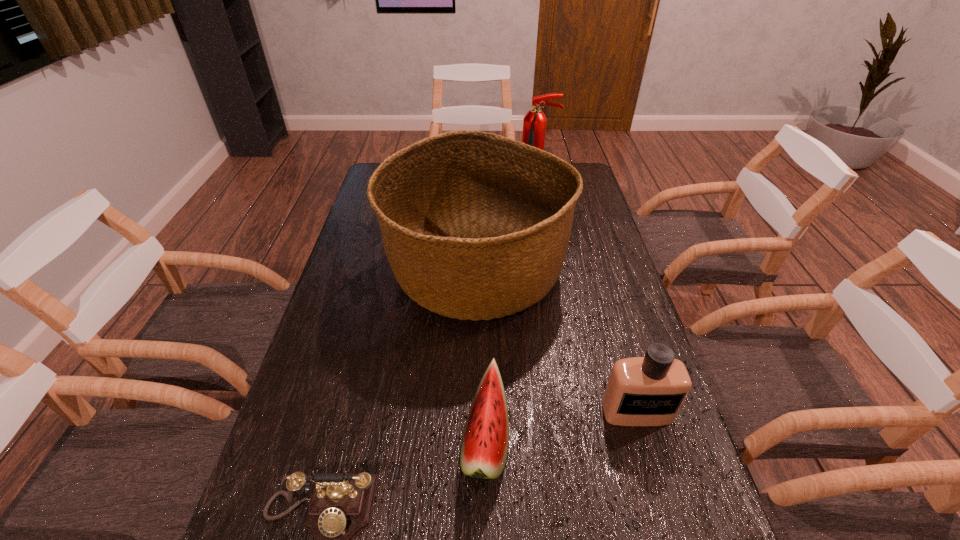
At what (x,y) coordinates should I click in order to perform the action: click on object that stands as the fourth closest to the fourth nearest object. Please return your answer as a coordinate pair (x, y). This screenshot has width=960, height=540. Looking at the image, I should click on (341, 506).

The width and height of the screenshot is (960, 540). What are the coordinates of `free space that satisfies the following two spatial constraints: 1. on the front label of the perfume; 2. on the outer rind of the watermelon` in the screenshot? It's located at (645, 440).